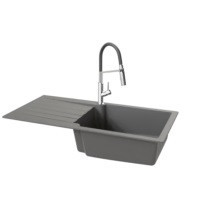
Find the location of a particular element. The width and height of the screenshot is (200, 200). sink is located at coordinates (130, 127).